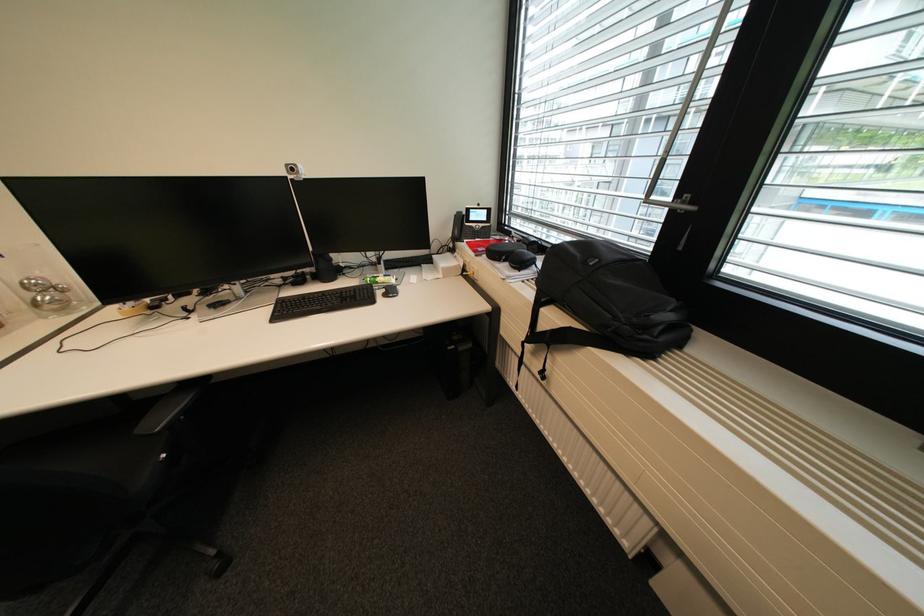
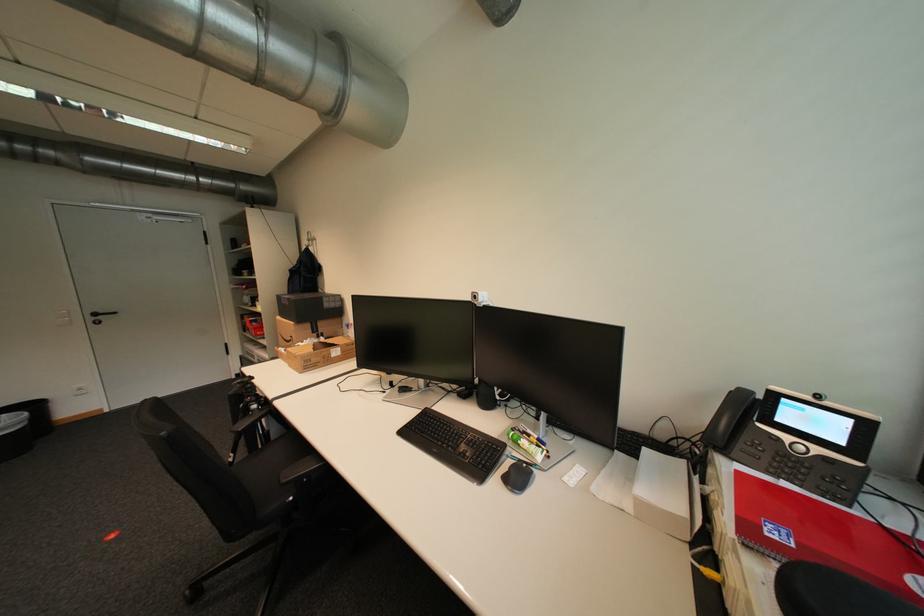
Question: I am providing you with two images of the same scene from different viewpoints. After the viewpoint changes to image2, which objects are now occluded?

Choices:
 (A) chair sitting surface
 (B) black door handle
 (C) black computer mouse
 (D) none of these

Answer: (D)